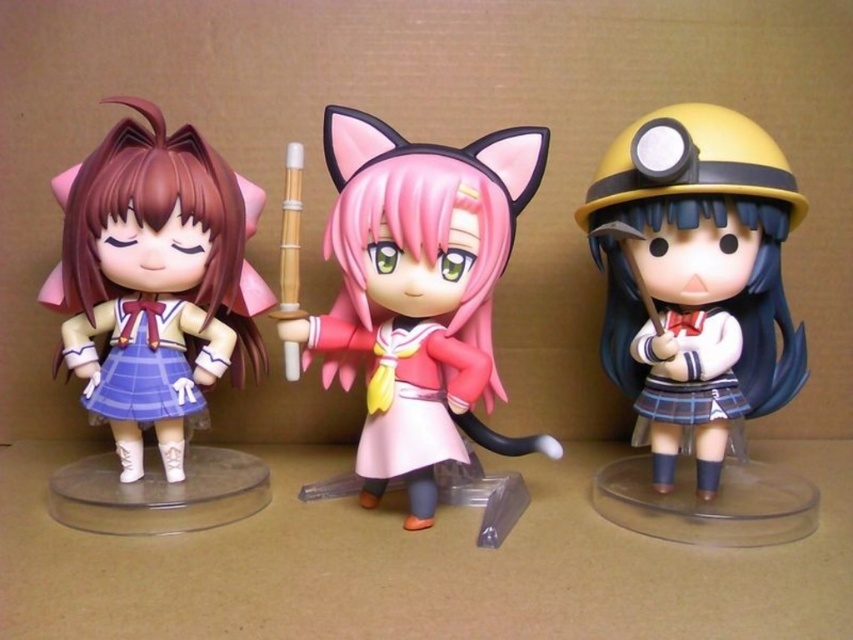
Is point (670, 134) positioned before point (154, 204)?

Yes, point (670, 134) is closer to viewer.

Between point (637, 301) and point (103, 212), which one is positioned in front?

Positioned in front is point (103, 212).

In order to click on matte yellow helmet at right in this screenshot , I will do `click(699, 323)`.

Between point (685, 230) and point (426, 252), which one is positioned in front?

Point (685, 230) is more forward.

This screenshot has width=853, height=640. In order to click on matte yellow helmet at right in this screenshot , I will do `click(699, 323)`.

Is the position of pink matte/silk cat ears at center less distant than that of matte plastic doll at left?

Yes, it is in front of matte plastic doll at left.

Can you confirm if pink matte/silk cat ears at center is shorter than matte plastic doll at left?

No, pink matte/silk cat ears at center is not shorter than matte plastic doll at left.

Between point (297, 324) and point (123, 456), which one is positioned in front?

Point (297, 324) is more forward.

The image size is (853, 640). I want to click on pink matte/silk cat ears at center, so click(421, 291).